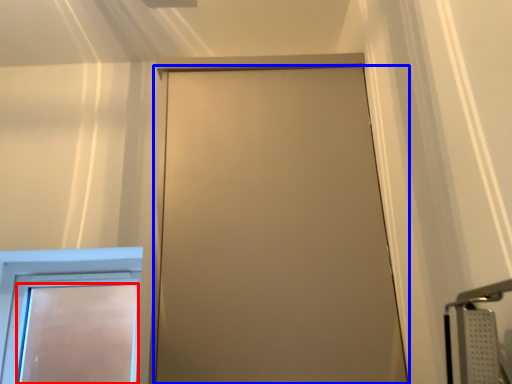
Question: Which object is closer to the camera taking this photo, door (highlighted by a red box) or door (highlighted by a blue box)?

Choices:
 (A) door
 (B) door

Answer: (B)